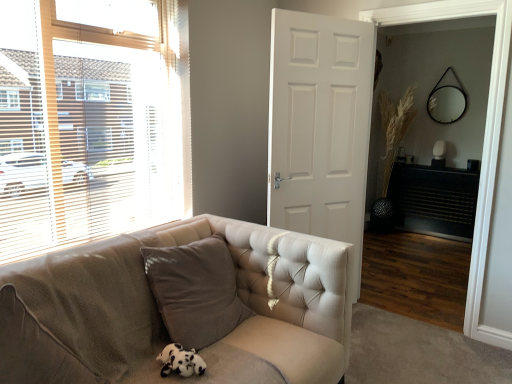
Where is `black plush toy at lower left`? The width and height of the screenshot is (512, 384). black plush toy at lower left is located at coordinates (180, 361).

This screenshot has height=384, width=512. Describe the element at coordinates (180, 361) in the screenshot. I see `black plush toy at lower left` at that location.

Find the location of a particular element. wooden screen door at center is located at coordinates (484, 135).

This screenshot has width=512, height=384. What are the coordinates of `wooden blinds at left` in the screenshot? It's located at (89, 122).

Measure the distance between point [297,159] and camera.

2.72 meters.

What is the approximate height of brown fabric pillow at lower center?

brown fabric pillow at lower center is 24.06 inches in height.

Image resolution: width=512 pixels, height=384 pixels. Describe the element at coordinates (160, 316) in the screenshot. I see `tufted fabric couch at center` at that location.

In order to click on black plush toy at lower left in this screenshot , I will do `click(180, 361)`.

Considering the sizes of black plush toy at lower left and wooden screen door at center in the image, is black plush toy at lower left taller or shorter than wooden screen door at center?

Clearly, black plush toy at lower left is shorter compared to wooden screen door at center.

How different are the orientations of black plush toy at lower left and wooden screen door at center in degrees?

There is a 90.3-degree angle between the facing directions of black plush toy at lower left and wooden screen door at center.

Considering the positions of objects black plush toy at lower left and wooden screen door at center in the image provided, who is more to the left, black plush toy at lower left or wooden screen door at center?

black plush toy at lower left.

Where is `screen door behind the black plush toy at lower left`? This screenshot has height=384, width=512. screen door behind the black plush toy at lower left is located at coordinates (484, 135).

Can you tell me how much tufted fabric couch at center and white matte door at center differ in facing direction?

tufted fabric couch at center and white matte door at center are facing 25.1 degrees away from each other.

Is tufted fabric couch at center not near white matte door at center?

No, tufted fabric couch at center is not far from white matte door at center.

Which is more to the right, tufted fabric couch at center or white matte door at center?

white matte door at center is more to the right.

How distant is brown fabric pillow at lower center from black textured fireplace at right?

A distance of 3.62 meters exists between brown fabric pillow at lower center and black textured fireplace at right.

Does point (183, 259) appear closer or farther from the camera than point (470, 207)?

Point (183, 259).

How many degrees apart are the facing directions of brown fabric pillow at lower center and black textured fireplace at right?

There is a 90.2-degree angle between the facing directions of brown fabric pillow at lower center and black textured fireplace at right.

Is brown fabric pillow at lower center taller or shorter than black textured fireplace at right?

brown fabric pillow at lower center is shorter than black textured fireplace at right.

The image size is (512, 384). What are the coordinates of `pillow located on the left of wooden screen door at center` in the screenshot? It's located at (195, 290).

Who is taller, brown fabric pillow at lower center or wooden screen door at center?

With more height is wooden screen door at center.

Does point (158, 299) appear closer or farther from the camera than point (487, 243)?

Point (158, 299) is closer to the camera than point (487, 243).

In terms of size, does wooden blinds at left appear bigger or smaller than tufted fabric couch at center?

Considering their sizes, wooden blinds at left takes up less space than tufted fabric couch at center.

From a real-world perspective, is wooden blinds at left under tufted fabric couch at center?

No, from a real-world perspective, wooden blinds at left is not beneath tufted fabric couch at center.

Does wooden blinds at left have a lesser width compared to tufted fabric couch at center?

Indeed, wooden blinds at left has a lesser width compared to tufted fabric couch at center.

From the image's perspective, who appears lower, wooden blinds at left or tufted fabric couch at center?

tufted fabric couch at center is shown below in the image.

Which object is thinner, wooden screen door at center or white matte door at center?

Thinner between the two is white matte door at center.

Could you tell me if wooden screen door at center is facing white matte door at center?

No.

From a real-world perspective, is wooden screen door at center positioned above or below white matte door at center?

Clearly, from a real-world perspective, wooden screen door at center is above white matte door at center.

From the image's perspective, is wooden screen door at center on white matte door at center?

Yes, from the image's perspective, wooden screen door at center is above white matte door at center.

Is there a large distance between black textured fireplace at right and black plush toy at lower left?

Indeed, black textured fireplace at right is not near black plush toy at lower left.

Looking at this image, is black textured fireplace at right facing away from black plush toy at lower left?

No, black textured fireplace at right is not facing away from black plush toy at lower left.

Is black textured fireplace at right inside the boundaries of black plush toy at lower left, or outside?

black textured fireplace at right is spatially situated outside black plush toy at lower left.

Looking at their sizes, would you say black textured fireplace at right is wider or thinner than black plush toy at lower left?

Considering their sizes, black textured fireplace at right looks broader than black plush toy at lower left.

Where is `screen door behind the black plush toy at lower left`? This screenshot has height=384, width=512. screen door behind the black plush toy at lower left is located at coordinates (484, 135).

Where is `studio couch on the left of the white matte door at center`? studio couch on the left of the white matte door at center is located at coordinates (160, 316).

Looking at the image, which one is located closer to wooden blinds at left, black plush toy at lower left or black textured fireplace at right?

Based on the image, black plush toy at lower left appears to be nearer to wooden blinds at left.

Which object lies further to the anchor point brown fabric pillow at lower center, white matte door at center or black plush toy at lower left?

white matte door at center is positioned further to the anchor brown fabric pillow at lower center.

Which object lies nearer to the anchor point tufted fabric couch at center, wooden blinds at left or black textured fireplace at right?

The object closer to tufted fabric couch at center is wooden blinds at left.

From the image, which object appears to be farther from wooden screen door at center, black textured fireplace at right or white matte door at center?

black textured fireplace at right is further to wooden screen door at center.

From the image, which object appears to be farther from black plush toy at lower left, brown fabric pillow at lower center or white matte door at center?

Among the two, white matte door at center is located further to black plush toy at lower left.

From the image, which object appears to be farther from wooden screen door at center, black textured fireplace at right or brown fabric pillow at lower center?

Among the two, black textured fireplace at right is located further to wooden screen door at center.

Which object lies further to the anchor point black textured fireplace at right, black plush toy at lower left or tufted fabric couch at center?

black plush toy at lower left.

Estimate the real-world distances between objects in this image. Which object is closer to brown fabric pillow at lower center, tufted fabric couch at center or wooden blinds at left?

tufted fabric couch at center lies closer to brown fabric pillow at lower center than the other object.

Where is `window between tufted fabric couch at center and white matte door at center from front to back`? This screenshot has width=512, height=384. window between tufted fabric couch at center and white matte door at center from front to back is located at coordinates (89, 122).

This screenshot has width=512, height=384. Find the location of `screen door located between tufted fabric couch at center and white matte door at center in the depth direction`. screen door located between tufted fabric couch at center and white matte door at center in the depth direction is located at coordinates (484, 135).

This screenshot has width=512, height=384. I want to click on screen door located between brown fabric pillow at lower center and black textured fireplace at right in the depth direction, so click(x=484, y=135).

Locate an element on the screen. pillow between wooden blinds at left and tufted fabric couch at center vertically is located at coordinates (195, 290).